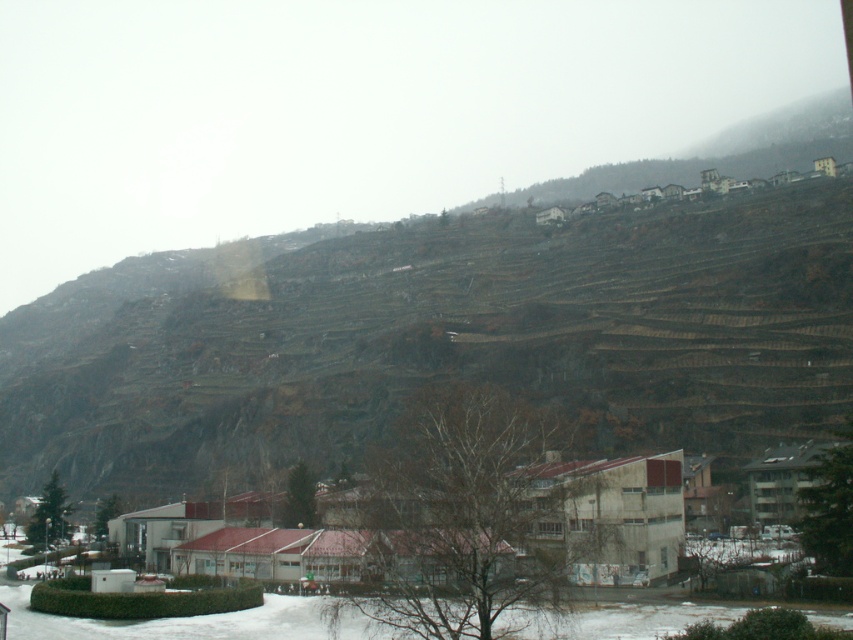
Question: Which point appears closest to the camera in this image?

Choices:
 (A) tap(845, 582)
 (B) tap(730, 172)

Answer: (A)

Question: Is white concrete buildings at lower center behind brown stone houses at upper right?

Choices:
 (A) no
 (B) yes

Answer: (A)

Question: Is white concrete buildings at lower center in front of brown stone houses at upper right?

Choices:
 (A) no
 (B) yes

Answer: (B)

Question: Which point is farther to the camera?

Choices:
 (A) white concrete buildings at lower center
 (B) brown stone houses at upper right

Answer: (B)

Question: Can you confirm if white concrete buildings at lower center is wider than brown stone houses at upper right?

Choices:
 (A) no
 (B) yes

Answer: (A)